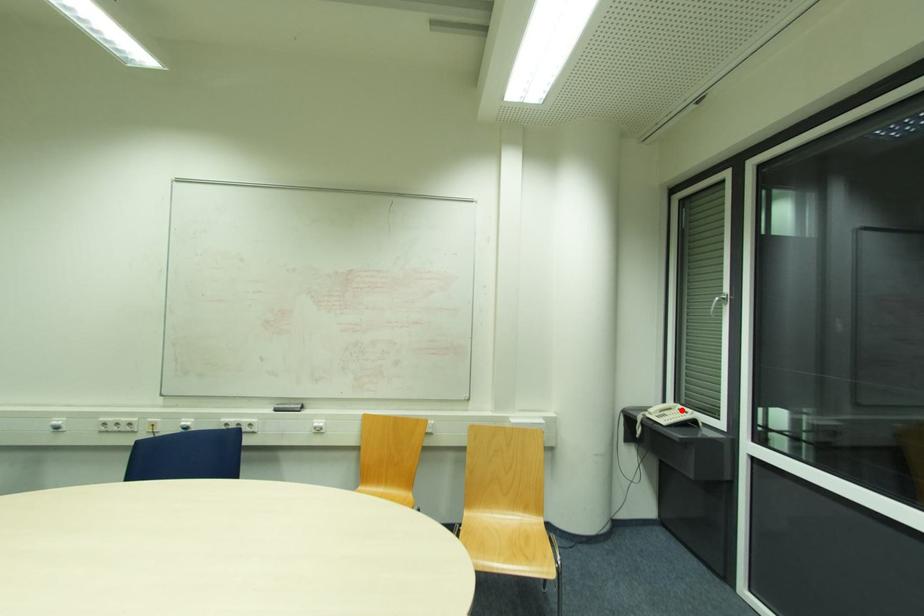
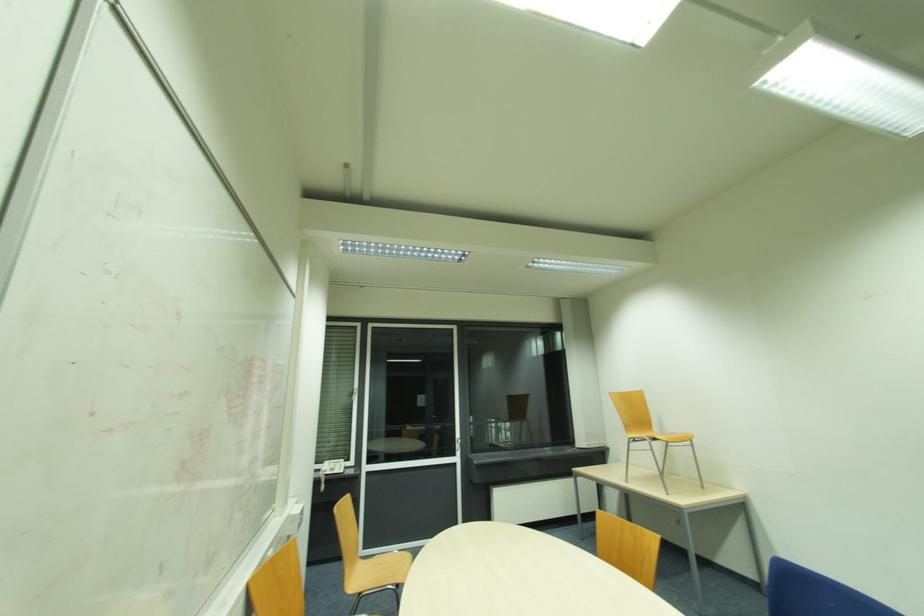
In the second image, find the point that corresponds to the highlighted location in the first image.

(334, 463)